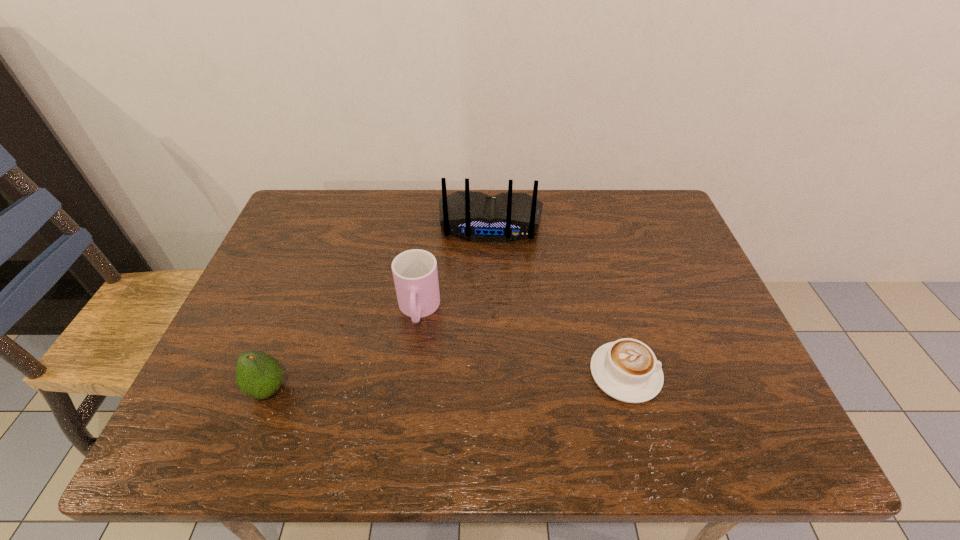
The width and height of the screenshot is (960, 540). Find the location of `avocado`. avocado is located at coordinates (258, 375).

You are a GUI agent. You are given a task and a screenshot of the screen. Output one action in this format:
    pyautogui.click(x=<x>, y=<y>)
    Task: Click on the cappuccino
    
    Given the screenshot: What is the action you would take?
    pyautogui.click(x=627, y=370)

At what (x,y) coordinates should I click in order to perform the action: click on the rightmost object. Please return your answer as a coordinate pair (x, y). Image resolution: width=960 pixels, height=540 pixels. Looking at the image, I should click on (627, 370).

Locate an element on the screen. The width and height of the screenshot is (960, 540). router is located at coordinates (476, 216).

What are the coordinates of `the farthest object` in the screenshot? It's located at (476, 216).

Locate an element on the screen. This screenshot has height=540, width=960. cup is located at coordinates (415, 274).

Identify the location of vacant space located 0.180m on the back of the leftmost object. This screenshot has height=540, width=960. (299, 309).

You are a GUI agent. You are given a task and a screenshot of the screen. Output one action in this format:
    pyautogui.click(x=<x>, y=<y>)
    Task: Click on the vacant space situated with the handle on the right side of the shortest object
    Image resolution: width=960 pixels, height=540 pixels.
    Given the screenshot: What is the action you would take?
    pyautogui.click(x=698, y=373)

This screenshot has width=960, height=540. In order to click on free location located on the back of the farthest object in this screenshot , I will do `click(483, 347)`.

Identify the location of free space located 0.280m on the back of the farthest object. (484, 326).